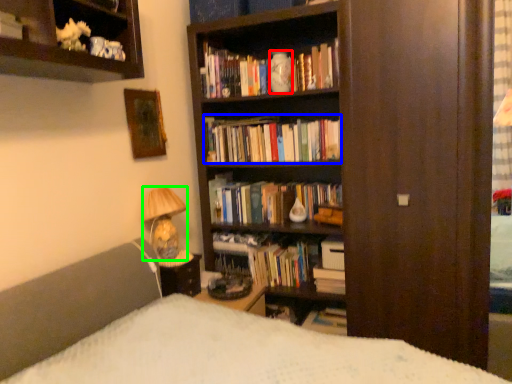
Question: Which is nearer to the vase (highlighted by a red box)? book (highlighted by a blue box) or lamp (highlighted by a green box).

Choices:
 (A) book
 (B) lamp

Answer: (A)